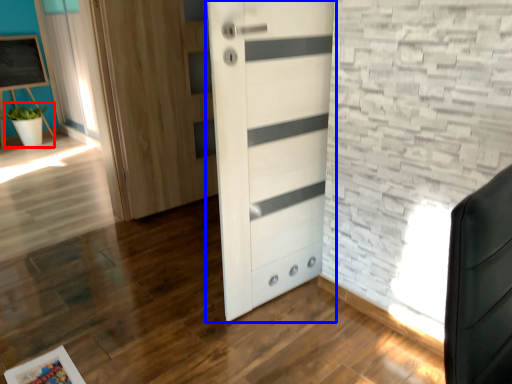
Question: Which point is further to the camera, plant (highlighted by a red box) or door (highlighted by a blue box)?

Choices:
 (A) plant
 (B) door

Answer: (A)